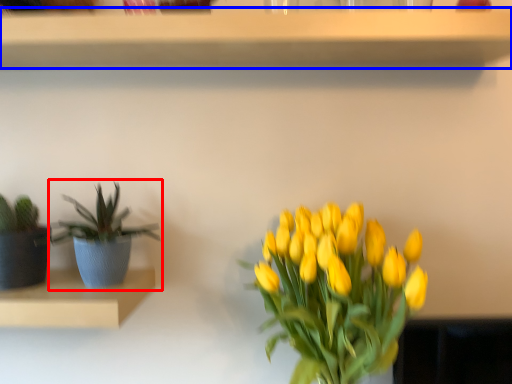
Question: Which point is closer to the camera, houseplant (highlighted by a red box) or shelf (highlighted by a blue box)?

Choices:
 (A) houseplant
 (B) shelf

Answer: (B)